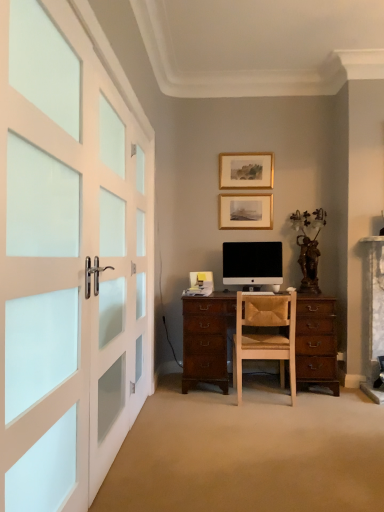
Question: From the image's perspective, is wooden picture frame at center, marked as the first picture frame in a bottom-to-top arrangement, on black matte computer monitor at center?

Choices:
 (A) yes
 (B) no

Answer: (A)

Question: Considering the relative sizes of wooden picture frame at center, marked as the first picture frame in a bottom-to-top arrangement, and black matte computer monitor at center in the image provided, is wooden picture frame at center, marked as the first picture frame in a bottom-to-top arrangement, bigger than black matte computer monitor at center?

Choices:
 (A) no
 (B) yes

Answer: (A)

Question: Is wooden picture frame at center, which ranks as the second picture frame in top-to-bottom order, turned away from black matte computer monitor at center?

Choices:
 (A) no
 (B) yes

Answer: (A)

Question: From a real-world perspective, is wooden picture frame at center, marked as the first picture frame in a bottom-to-top arrangement, physically below black matte computer monitor at center?

Choices:
 (A) no
 (B) yes

Answer: (A)

Question: Does wooden picture frame at center, marked as the first picture frame in a bottom-to-top arrangement, have a greater width compared to black matte computer monitor at center?

Choices:
 (A) yes
 (B) no

Answer: (B)

Question: Can you confirm if wooden picture frame at center, which ranks as the second picture frame in top-to-bottom order, is positioned to the left of black matte computer monitor at center?

Choices:
 (A) no
 (B) yes

Answer: (B)

Question: Is black matte computer monitor at center wider than gold/glossy picture frame at upper center, which is the second picture frame in bottom-to-top order?

Choices:
 (A) yes
 (B) no

Answer: (A)

Question: Does black matte computer monitor at center appear on the left side of gold/glossy picture frame at upper center, which appears as the 1th picture frame when viewed from the top?

Choices:
 (A) no
 (B) yes

Answer: (A)

Question: Does black matte computer monitor at center have a greater height compared to gold/glossy picture frame at upper center, which appears as the 1th picture frame when viewed from the top?

Choices:
 (A) yes
 (B) no

Answer: (A)

Question: Is black matte computer monitor at center not inside gold/glossy picture frame at upper center, which appears as the 1th picture frame when viewed from the top?

Choices:
 (A) yes
 (B) no

Answer: (A)

Question: Can you confirm if black matte computer monitor at center is positioned to the right of gold/glossy picture frame at upper center, which is the second picture frame in bottom-to-top order?

Choices:
 (A) no
 (B) yes

Answer: (B)

Question: Does black matte computer monitor at center have a smaller size compared to gold/glossy picture frame at upper center, which is the second picture frame in bottom-to-top order?

Choices:
 (A) no
 (B) yes

Answer: (A)

Question: Considering the relative sizes of gold/glossy picture frame at upper center, which is the second picture frame in bottom-to-top order, and wooden picture frame at center, which ranks as the second picture frame in top-to-bottom order, in the image provided, is gold/glossy picture frame at upper center, which is the second picture frame in bottom-to-top order, thinner than wooden picture frame at center, which ranks as the second picture frame in top-to-bottom order,?

Choices:
 (A) yes
 (B) no

Answer: (B)